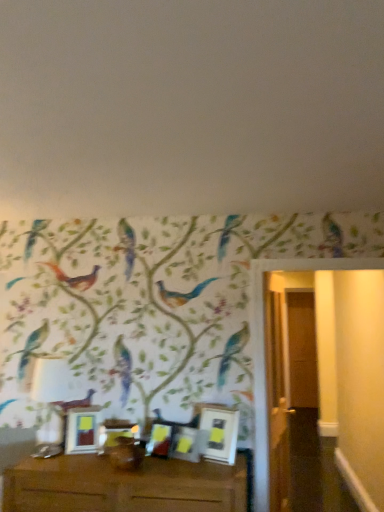
The image size is (384, 512). In order to click on empty space that is ontop of brown wooden table at lower center (from a real-world perspective) in this screenshot , I will do `click(127, 460)`.